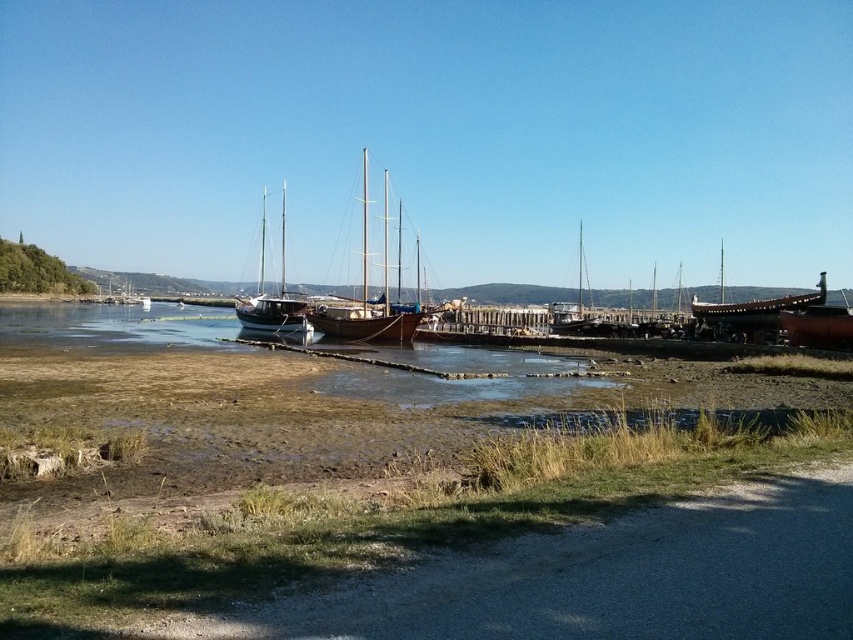
Question: Is wooden sailboat at center to the right of wooden boat at right from the viewer's perspective?

Choices:
 (A) yes
 (B) no

Answer: (B)

Question: Based on their relative distances, which object is nearer to the brown wooden dock at lower center?

Choices:
 (A) wooden sailboat at center
 (B) wooden ship at right

Answer: (A)

Question: Is wooden sailboat at center smaller than wooden boat at right?

Choices:
 (A) no
 (B) yes

Answer: (A)

Question: Which object is closer to the camera taking this photo?

Choices:
 (A) wooden ship at right
 (B) white wooden sailboat at center
 (C) wooden boat at right

Answer: (C)

Question: Which object is positioned closest to the white wooden sailboat at center?

Choices:
 (A) wooden ship at right
 (B) wooden sailboat at center
 (C) brown wooden dock at lower center
 (D) wooden boat at right

Answer: (B)

Question: Does white wooden sailboat at center have a larger size compared to wooden boat at right?

Choices:
 (A) no
 (B) yes

Answer: (B)